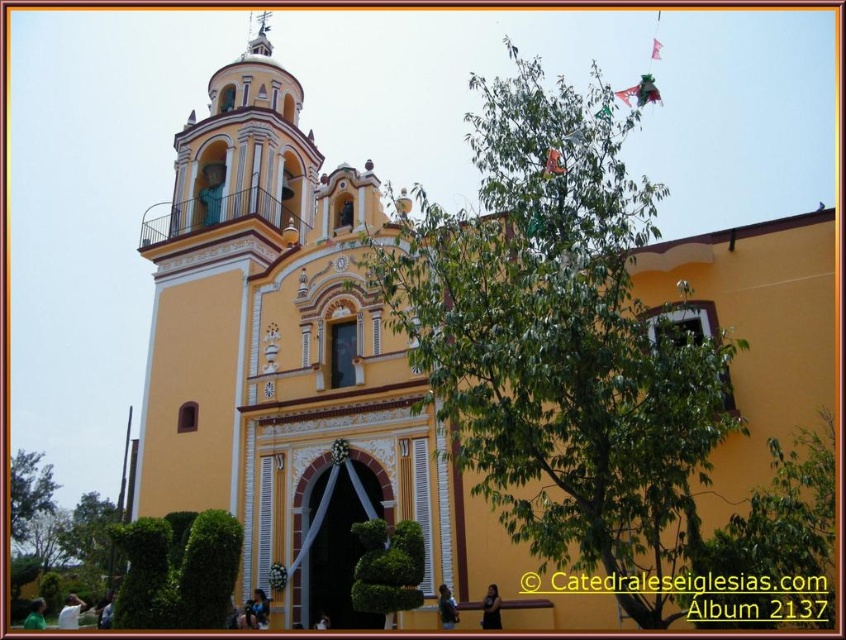
Question: Among these points, which one is nearest to the camera?

Choices:
 (A) (17, 460)
 (B) (255, 20)

Answer: (B)

Question: Can you confirm if green leafy tree at lower left is bigger than smooth white spire at upper center?

Choices:
 (A) yes
 (B) no

Answer: (B)

Question: Does green leafy tree at lower left come behind smooth white spire at upper center?

Choices:
 (A) yes
 (B) no

Answer: (A)

Question: Does green leafy tree at lower left appear on the left side of smooth white spire at upper center?

Choices:
 (A) no
 (B) yes

Answer: (B)